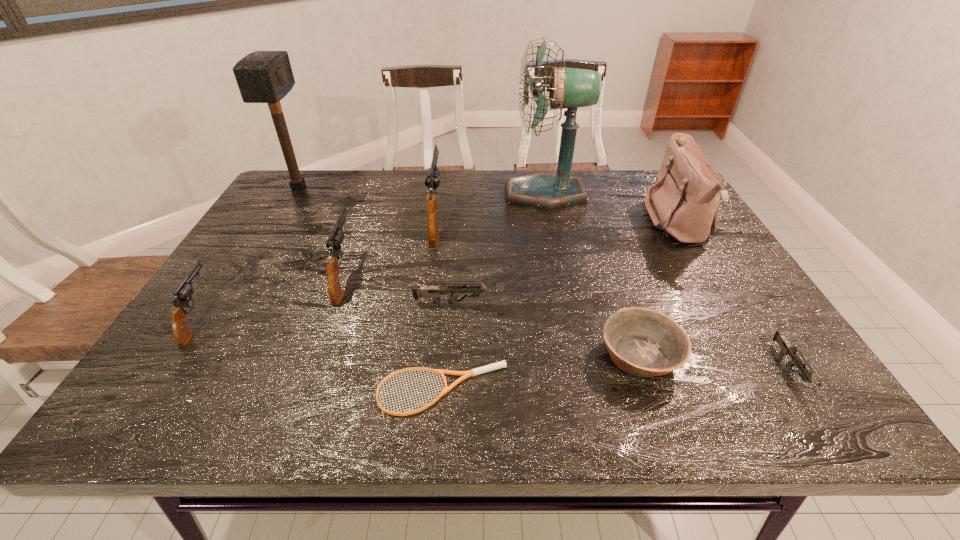
You are a GUI agent. You are given a task and a screenshot of the screen. Output one action in this format:
    pyautogui.click(x=<x>, y=<y>)
    Task: Click on the closest black gun to the leftmost black gun
    This screenshot has height=540, width=960.
    Given the screenshot: What is the action you would take?
    pyautogui.click(x=334, y=242)

Identify the location of free point that satisfies the following two spatial constraints: 1. aimed along the barrel of the bigger grey gun; 2. on the back side of the bowl. The height and width of the screenshot is (540, 960). (459, 355).

Where is `free space in the image that satisfies the following two spatial constraints: 1. in front of the blue fan where the wind blows; 2. on the back side of the bowl`? Image resolution: width=960 pixels, height=540 pixels. free space in the image that satisfies the following two spatial constraints: 1. in front of the blue fan where the wind blows; 2. on the back side of the bowl is located at coordinates (580, 355).